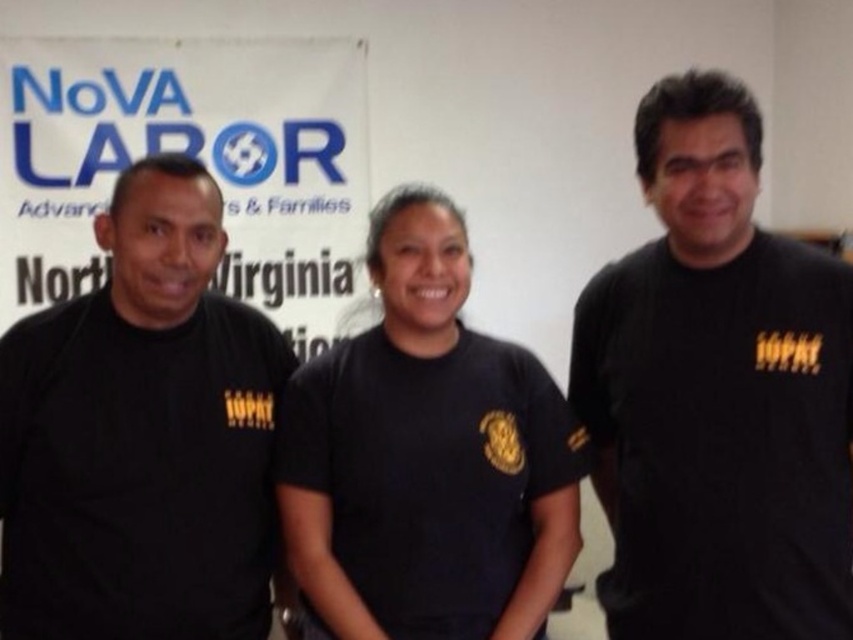
Can you confirm if black matte t-shirt at center is shorter than black matte t-shirt at left?

No, black matte t-shirt at center is not shorter than black matte t-shirt at left.

Does black matte t-shirt at center have a greater height compared to black matte t-shirt at left?

Yes.

Find the location of a particular element. The height and width of the screenshot is (640, 853). black matte t-shirt at center is located at coordinates (717, 394).

Is black matte t-shirt at center thinner than black matte shirt at center?

Correct, black matte t-shirt at center's width is less than black matte shirt at center's.

Is black matte t-shirt at center closer to camera compared to black matte shirt at center?

Yes, black matte t-shirt at center is in front of black matte shirt at center.

The height and width of the screenshot is (640, 853). I want to click on black matte t-shirt at center, so click(x=717, y=394).

At what (x,y) coordinates should I click in order to perform the action: click on black matte t-shirt at center. Please return your answer as a coordinate pair (x, y). The width and height of the screenshot is (853, 640). Looking at the image, I should click on (717, 394).

Can you confirm if black matte t-shirt at left is positioned below black matte shirt at center?

Yes.

Can you confirm if black matte t-shirt at left is thinner than black matte shirt at center?

Correct, black matte t-shirt at left's width is less than black matte shirt at center's.

Between point (68, 518) and point (445, 224), which one is positioned in front?

Point (68, 518)

Where is `black matte t-shirt at left`? This screenshot has height=640, width=853. black matte t-shirt at left is located at coordinates (142, 436).